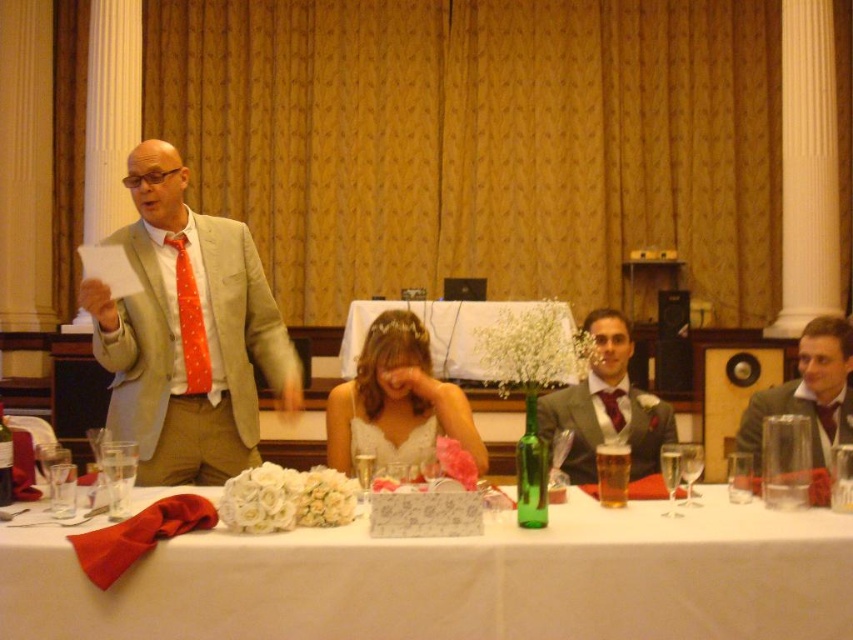
Consider the image. You are a photographer positioned at the entrance of the banquet hall. You want to capture a closeup shot of the white satin tablecloth at center. Based on its coordinates, which direction should you move to get closer to the tablecloth?

The white satin tablecloth at center is located at coordinates point (451, 332). Since photographers are at the entrance, moving towards the center of the hall would bring you closer to the tablecloth.

You are a guest at the wedding reception and notice two items at the center of the table. Which one is positioned lower between the white satin dress at center and the white satin tablecloth at center?

The white satin dress at center is positioned below the white satin tablecloth at center, so it is lower.